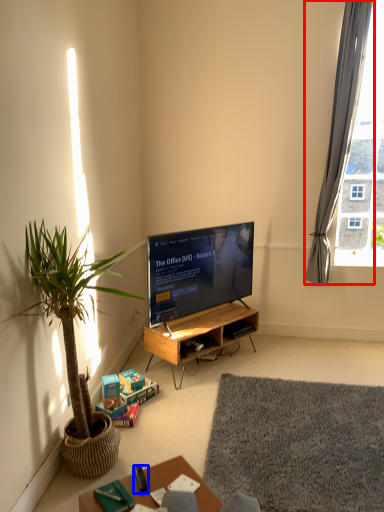
Question: Which of the following is the farthest to the observer, curtain (highlighted by a red box) or remote control (highlighted by a blue box)?

Choices:
 (A) curtain
 (B) remote control

Answer: (A)